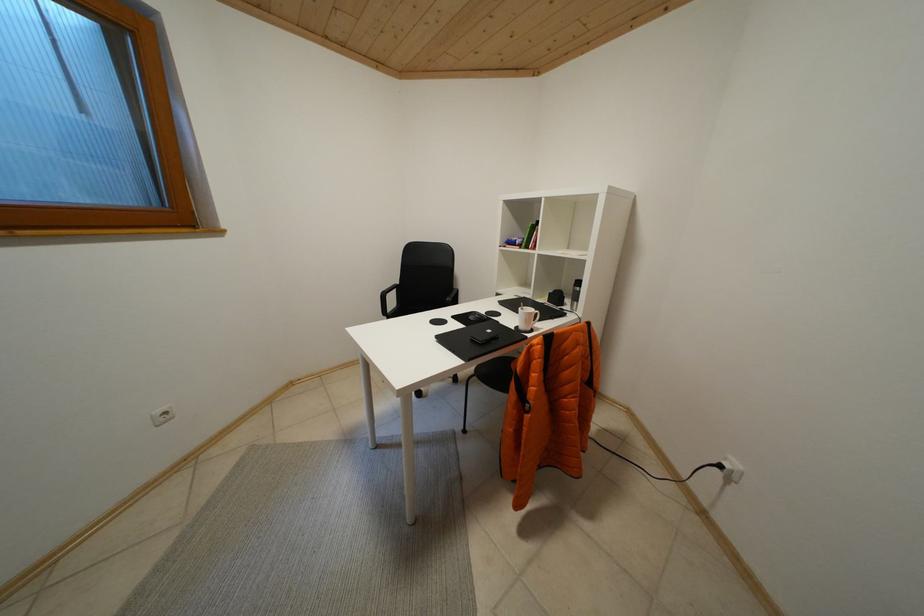
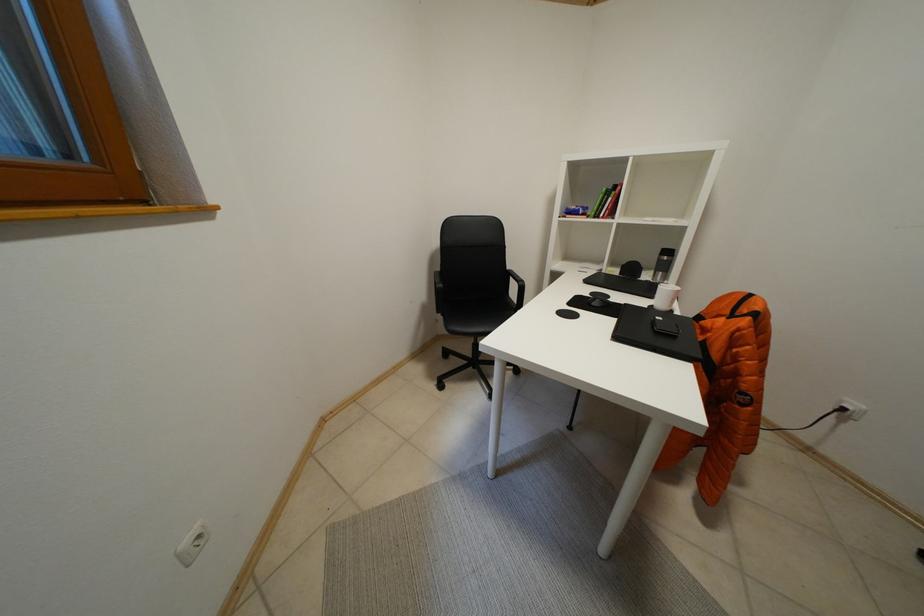
Question: The camera is either moving clockwise (left) or counter-clockwise (right) around the object. The first image is from the beginning of the video and the second image is from the end. Is the camera moving left or right when shooting the video?

Choices:
 (A) Left
 (B) Right

Answer: (A)